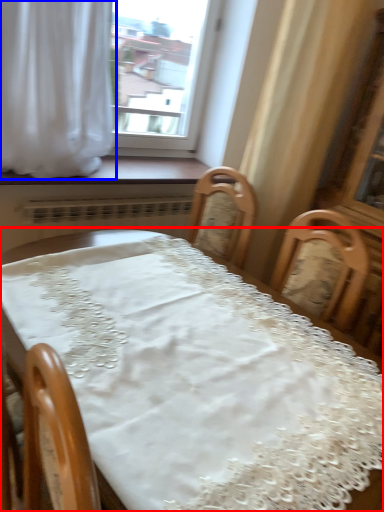
Question: Among these objects, which one is nearest to the camera, table (highlighted by a red box) or curtain (highlighted by a blue box)?

Choices:
 (A) table
 (B) curtain

Answer: (A)